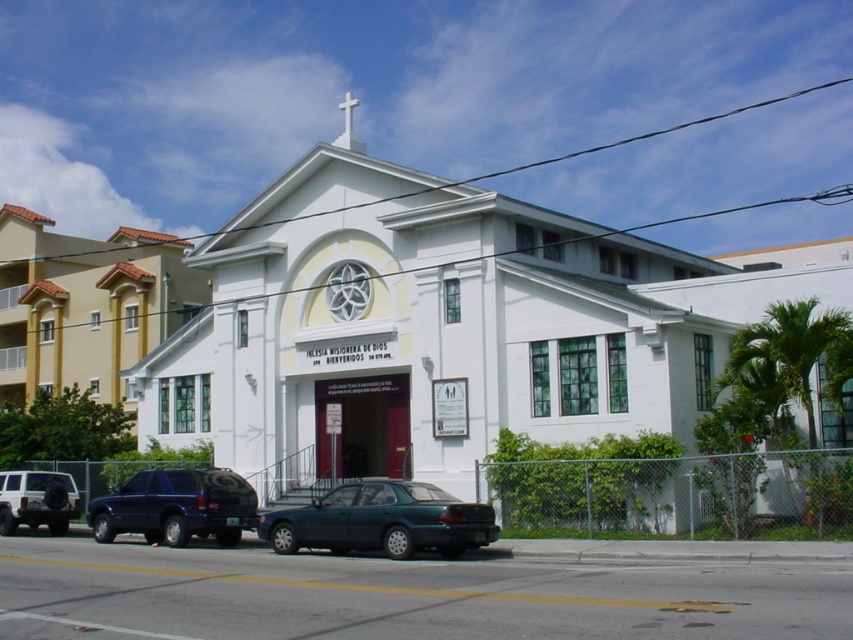
Find the location of a particular element. This screenshot has height=640, width=853. white smooth chapel at center is located at coordinates (442, 326).

Is white smooth chapel at center further to camera compared to metallic blue suv at lower left?

No, white smooth chapel at center is in front of metallic blue suv at lower left.

Between point (363, 211) and point (215, 538), which one is positioned behind?

Positioned behind is point (363, 211).

Where is `white smooth chapel at center`? white smooth chapel at center is located at coordinates 442,326.

Does beige stucco church at center appear under teal glossy sedan at center?

Incorrect, beige stucco church at center is not positioned below teal glossy sedan at center.

Consider the image. Is beige stucco church at center thinner than teal glossy sedan at center?

In fact, beige stucco church at center might be wider than teal glossy sedan at center.

Is point (131, 292) positioned before point (323, 540)?

That is False.

The image size is (853, 640). In order to click on beige stucco church at center in this screenshot , I will do `click(85, 305)`.

Is white smooth chapel at center positioned before teal glossy sedan at center?

No.

Measure the distance between white smooth chapel at center and camera.

white smooth chapel at center is 21.18 meters from camera.

Image resolution: width=853 pixels, height=640 pixels. What do you see at coordinates (442, 326) in the screenshot?
I see `white smooth chapel at center` at bounding box center [442, 326].

The height and width of the screenshot is (640, 853). Identify the location of white smooth chapel at center. (442, 326).